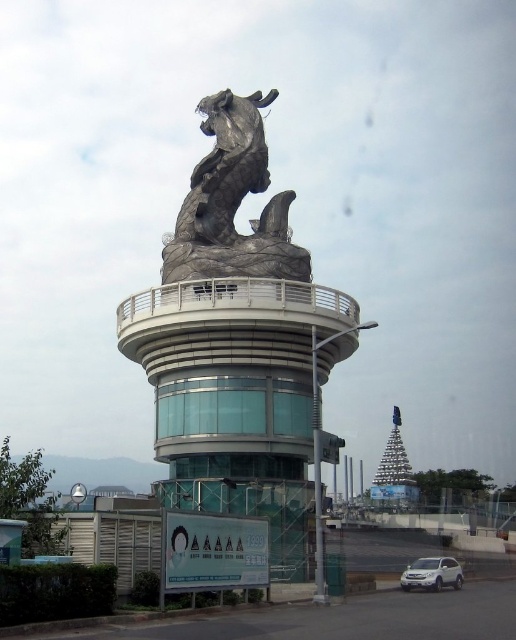
Question: Is shiny silver horse at center positioned before shiny silver pagoda at center?

Choices:
 (A) yes
 (B) no

Answer: (A)

Question: Which object is the farthest from the white matte suv at lower center?

Choices:
 (A) shiny silver horse at center
 (B) shiny silver pagoda at center

Answer: (A)

Question: Estimate the real-world distances between objects in this image. Which object is farther from the white matte suv at lower center?

Choices:
 (A) shiny silver horse at center
 (B) shiny silver pagoda at center

Answer: (A)

Question: Which of these objects is positioned farthest from the white matte suv at lower center?

Choices:
 (A) shiny silver horse at center
 (B) shiny silver pagoda at center

Answer: (A)

Question: Is shiny silver pagoda at center above white matte suv at lower center?

Choices:
 (A) no
 (B) yes

Answer: (B)

Question: From the image, what is the correct spatial relationship of shiny silver pagoda at center in relation to white matte suv at lower center?

Choices:
 (A) left
 (B) right

Answer: (B)